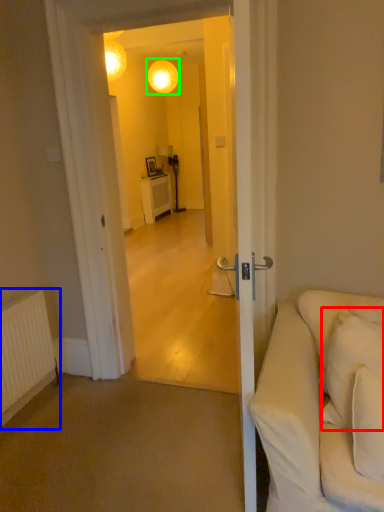
Question: Based on their relative distances, which object is nearer to pillow (highlighted by a red box)? Choose from radiator (highlighted by a blue box) and lamp (highlighted by a green box).

Choices:
 (A) radiator
 (B) lamp

Answer: (A)